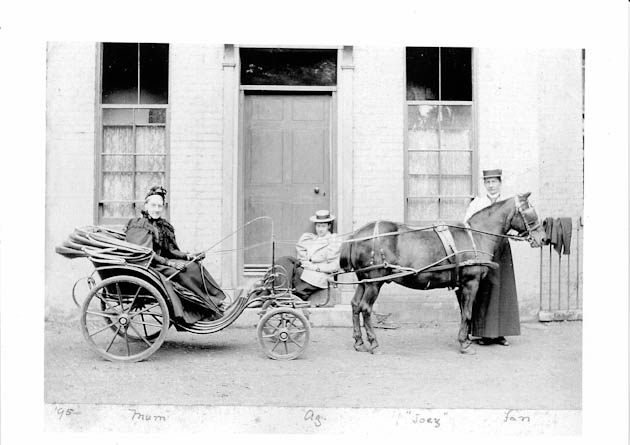
Image resolution: width=630 pixels, height=445 pixels. In order to click on door in this screenshot , I will do `click(287, 166)`.